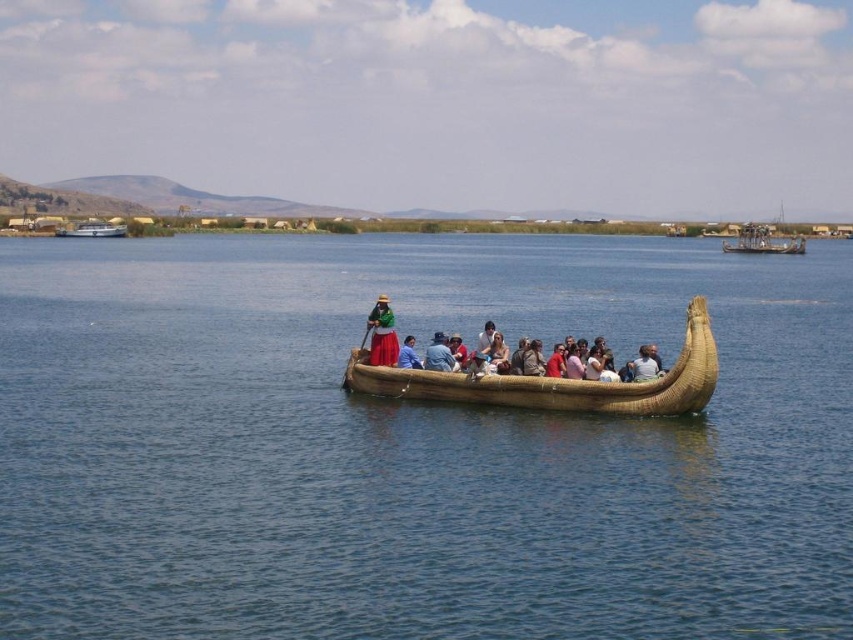
Question: Estimate the real-world distances between objects in this image. Which object is closer to the blue fabric at center?

Choices:
 (A) white glossy boat at upper left
 (B) metallic silver boat at upper right
 (C) brown woven boat at center
 (D) matte brown boat at center

Answer: (D)

Question: Does matte brown boat at center come in front of blue fabric shirt at center?

Choices:
 (A) no
 (B) yes

Answer: (B)

Question: Which object is positioned farthest from the natural woven reed boat at center?

Choices:
 (A) light brown woven reed boat at center
 (B) blue fabric at center

Answer: (B)

Question: Is matte brown boat at center thinner than blue fabric at center?

Choices:
 (A) no
 (B) yes

Answer: (A)

Question: Is metallic silver boat at upper right to the left of blue fabric shirt at center from the viewer's perspective?

Choices:
 (A) no
 (B) yes

Answer: (A)

Question: Which of the following is the closest to the observer?

Choices:
 (A) (86, 236)
 (B) (440, 396)
 (C) (422, 628)

Answer: (C)